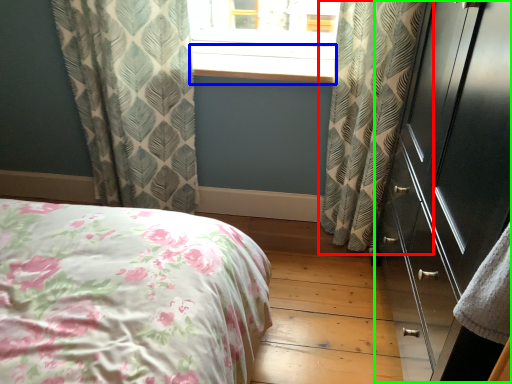
Question: Which is nearer to the curtain (highlighted by a red box)? window sill (highlighted by a blue box) or dresser (highlighted by a green box).

Choices:
 (A) window sill
 (B) dresser

Answer: (B)